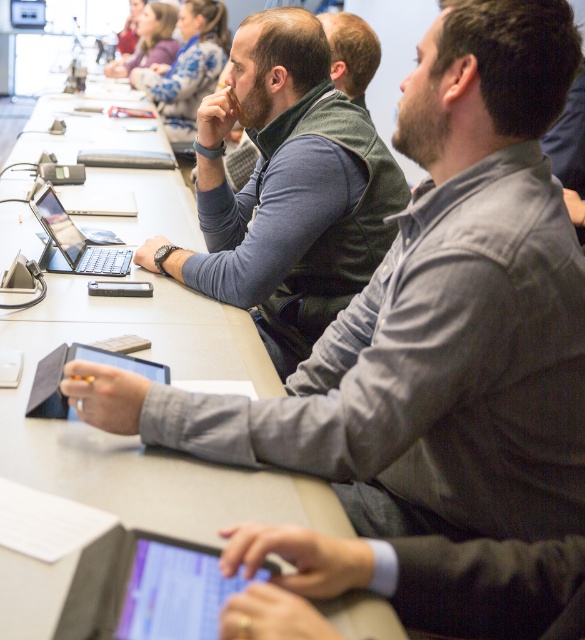
You are organizing a meeting and need to place a new object between the black matte tablet at center and the matte black jacket at upper left. Which object should you place closer to the tablet to ensure it fits better? The new object is 10 cm in width, and the tablet is 8 cm wide.

The new object should be placed closer to the black matte tablet at center since it is smaller in size compared to the matte black jacket at upper left, ensuring better fit.

You are a photographer standing at the camera position. You want to place a 28 inch long ruler on the gray matte table at center so that it extends from the edge of the table towards you. Will the ruler fit entirely on the table without overhanging the edge?

The gray matte table at center and camera are 27.97 inches apart. Since the ruler is 28 inches long, it will overhang the edge of the table by approximately 0.03 inches, so it won